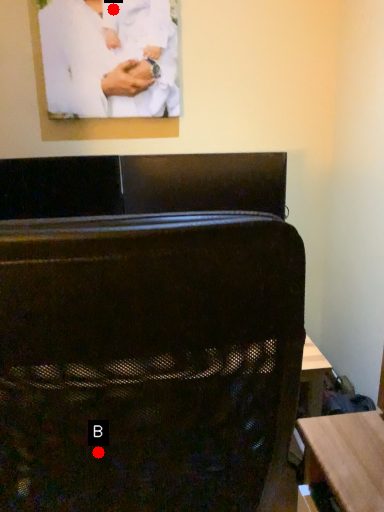
Question: Two points are circled on the image, labeled by A and B beside each circle. Which point is closer to the camera?

Choices:
 (A) A is closer
 (B) B is closer

Answer: (B)